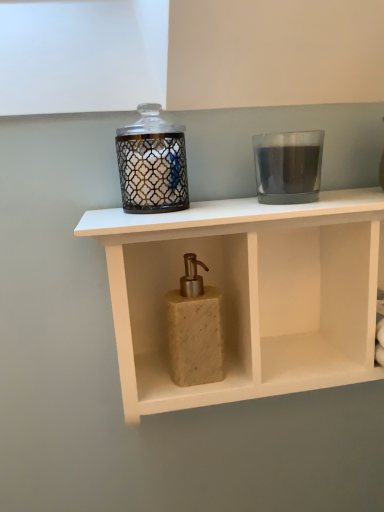
Identify the location of vacant area that lies in front of matte glass candle holder at upper center, which is the first candle holder in left-to-right order. The image size is (384, 512). (141, 219).